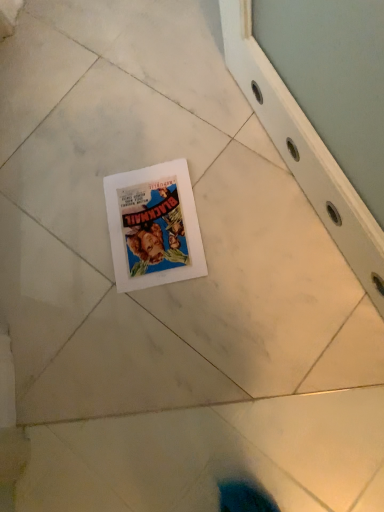
Image resolution: width=384 pixels, height=512 pixels. I want to click on free space to the back side of matte paper comic book at center, so click(x=108, y=147).